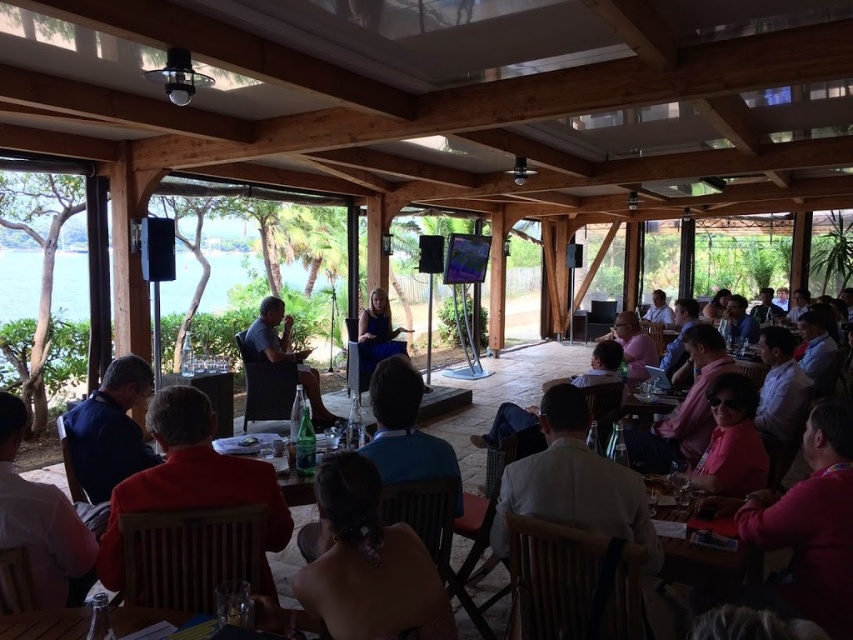
Question: Can you confirm if blue shirt at lower left is smaller than clear glass table at lower center?

Choices:
 (A) yes
 (B) no

Answer: (B)

Question: Which object appears closest to the camera in this image?

Choices:
 (A) matte black hair at center
 (B) orange fabric jacket at lower left

Answer: (A)

Question: Is clear glass table at lower center bigger than matte black laptop at left?

Choices:
 (A) yes
 (B) no

Answer: (B)

Question: Does orange fabric jacket at lower left have a greater width compared to white shirt at lower left?

Choices:
 (A) yes
 (B) no

Answer: (A)

Question: Estimate the real-world distances between objects in this image. Which object is farther from the matte black laptop at left?

Choices:
 (A) matte blue dress at center
 (B) white shirt at lower left
 (C) clear plastic table at center
 (D) orange fabric jacket at lower left

Answer: (B)

Question: Considering the real-world distances, which object is closest to the orange fabric jacket at lower left?

Choices:
 (A) white shirt at lower left
 (B) matte black laptop at left

Answer: (A)